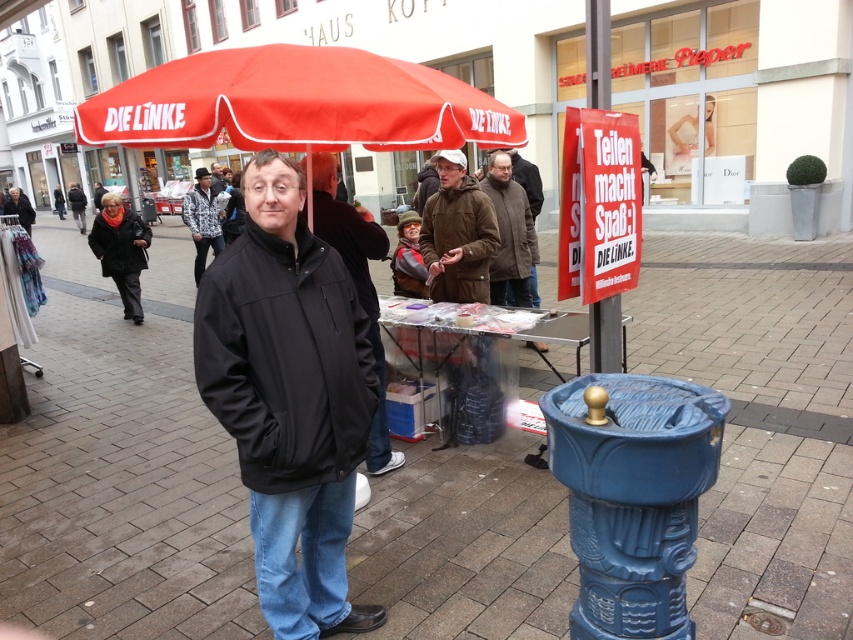
You are a fashion blogger trying to decide between two jackets displayed at the center of a busy pedestrian street. The jackets are a brown woolen jacket at center and a brown fuzzy jacket at center. Based on their appearance, which jacket might have a larger width when worn?

The brown woolen jacket at center might be wider than the brown fuzzy jacket at center, so the brown woolen jacket at center could have a larger width when worn.